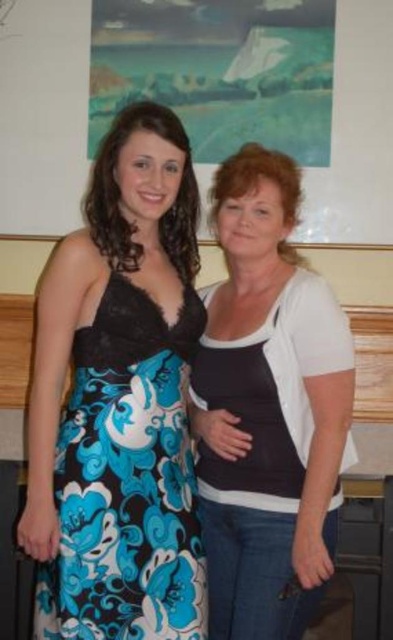
Which is more to the right, white matte tank top at center or floral-patterned fabric dress at center?

Positioned to the right is white matte tank top at center.

Can you confirm if white matte tank top at center is positioned to the right of floral-patterned fabric dress at center?

Correct, you'll find white matte tank top at center to the right of floral-patterned fabric dress at center.

In order to click on white matte tank top at center in this screenshot , I will do `click(268, 408)`.